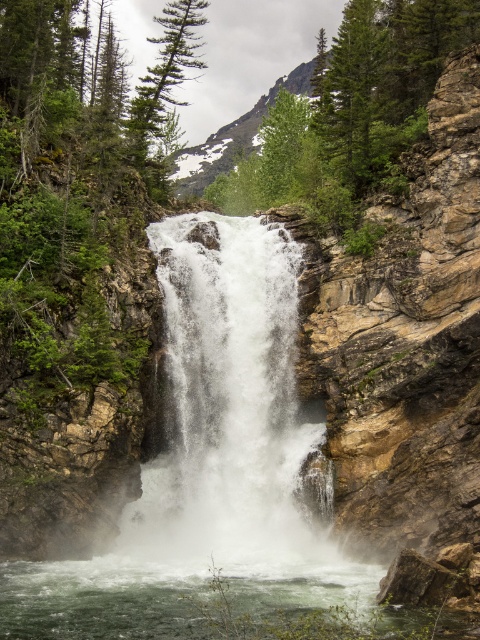
Question: Which point is farther to the camera?

Choices:
 (A) (295, 518)
 (B) (49, 636)

Answer: (A)

Question: Does white frothy water at center appear on the right side of green frothy water at lower center?

Choices:
 (A) no
 (B) yes

Answer: (A)

Question: Can you confirm if white frothy water at center is positioned to the right of green frothy water at lower center?

Choices:
 (A) no
 (B) yes

Answer: (A)

Question: Which of the following is the closest to the observer?

Choices:
 (A) tap(88, 604)
 (B) tap(178, 417)

Answer: (A)

Question: Is white frothy water at center closer to the viewer compared to green frothy water at lower center?

Choices:
 (A) no
 (B) yes

Answer: (A)